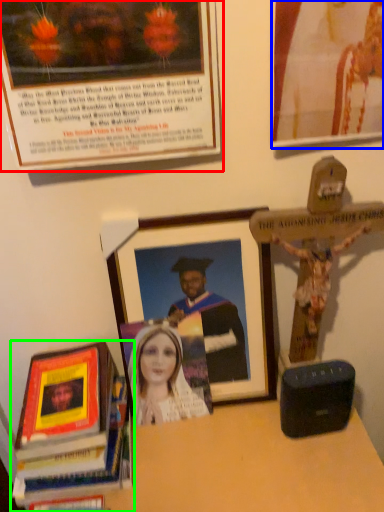
Question: Estimate the real-world distances between objects in this image. Which object is closer to picture frame (highlighted by a red box), picture frame (highlighted by a blue box) or book (highlighted by a green box)?

Choices:
 (A) picture frame
 (B) book

Answer: (A)